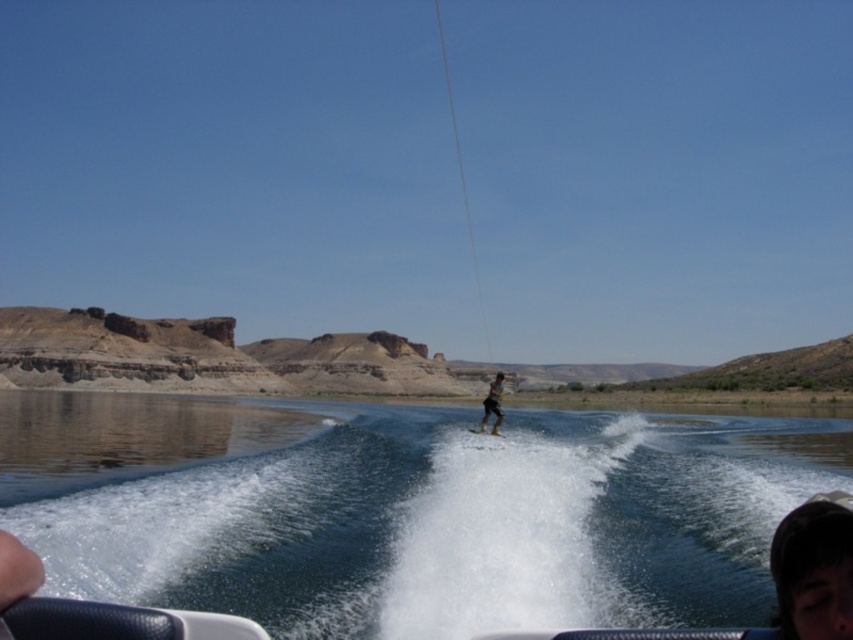
Question: Does clear blue water at center lie behind smooth skin face at lower right?

Choices:
 (A) yes
 (B) no

Answer: (A)

Question: Is smooth skin face at lower right smaller than white matte water ski at center?

Choices:
 (A) no
 (B) yes

Answer: (A)

Question: Which point is closer to the camera?

Choices:
 (A) dark brown leather shorts at center
 (B) smooth skin face at lower right
 (C) clear blue water at center
 (D) white matte water ski at center

Answer: (B)

Question: Which object is closer to the camera taking this photo?

Choices:
 (A) white matte water ski at center
 (B) clear blue water at center

Answer: (B)

Question: Can you confirm if clear blue water at center is smaller than smooth skin face at lower right?

Choices:
 (A) yes
 (B) no

Answer: (B)

Question: Which object is farther from the camera taking this photo?

Choices:
 (A) white matte water ski at center
 (B) clear blue water at center

Answer: (A)